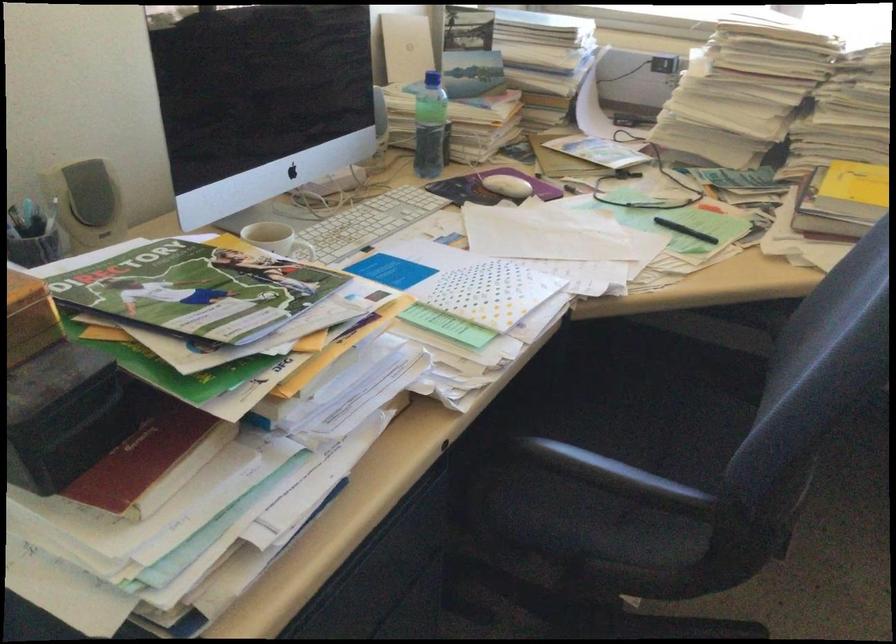
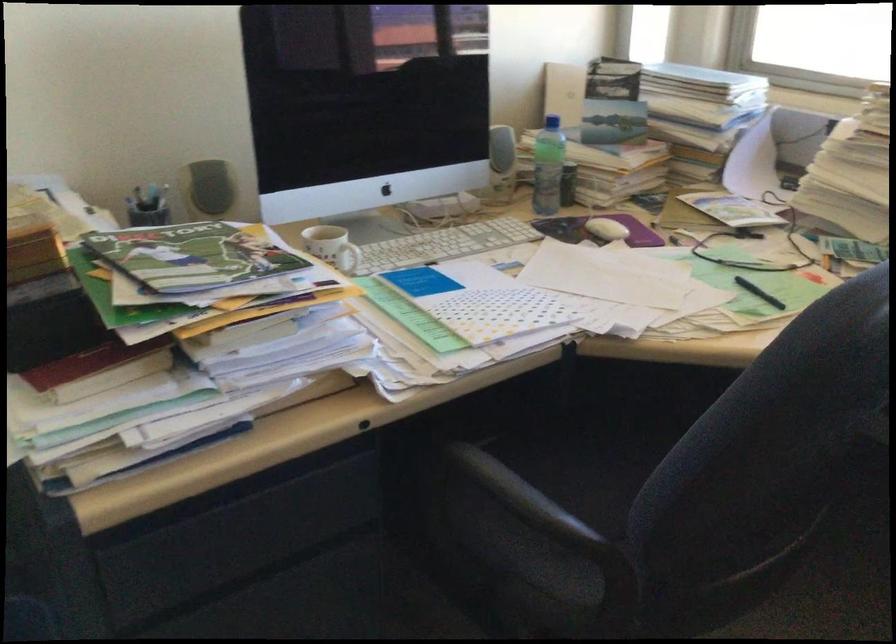
The point at (655, 483) is marked in the first image. Where is the corresponding point in the second image?

(532, 506)